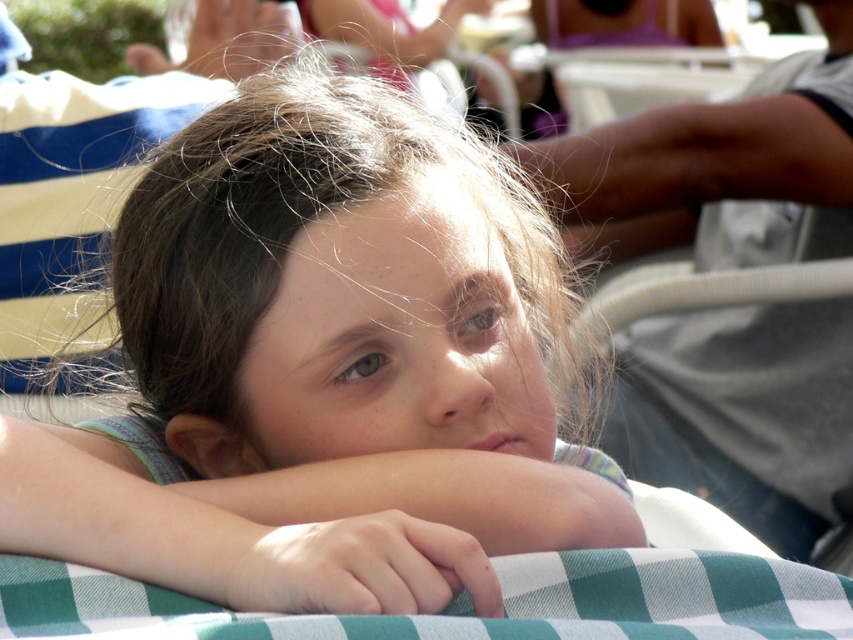
You are a photographer trying to capture a candid shot of the smooth skin child at center. If your camera lens has a minimum focusing distance of 24 inches, will you be able to take a clear photo without moving closer?

The smooth skin child at center and camera are 22.27 inches apart from each other, which is within the camera lens minimum focusing distance of 24 inches. Therefore, you can take a clear photo without moving closer.

You are a photographer trying to capture the girl in the scene. To ensure the green checkered fabric at center is visible in the background, where should you position the camera relative to the smooth skin child at center?

The smooth skin child at center is above the green checkered fabric at center, so positioning the camera below the child would allow the fabric to be visible in the background.

You are a photographer trying to capture a close shot of the smooth skin child at center and the green checkered fabric at center. Your camera can focus on objects within a 5 inch range. Can you focus on both objects at the same time?

The smooth skin child at center is 4.98 inches from green checkered fabric at center, so yes, the camera can focus on both objects at the same time since the distance between them is within the 5 inch range.